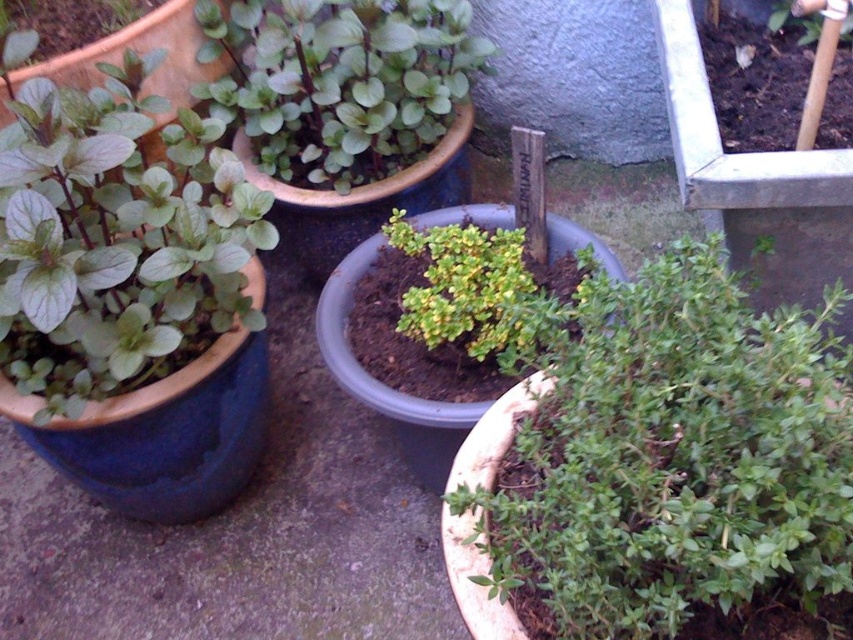
You are standing in the garden looking at the potted plants. There are two points marked in the scene. The first point is at coordinates point (689, 401) and the second is at point (245, 131). Which point is closer to you?

A: Point (689, 401) is in front of point (245, 131), so the first point is closer to you.